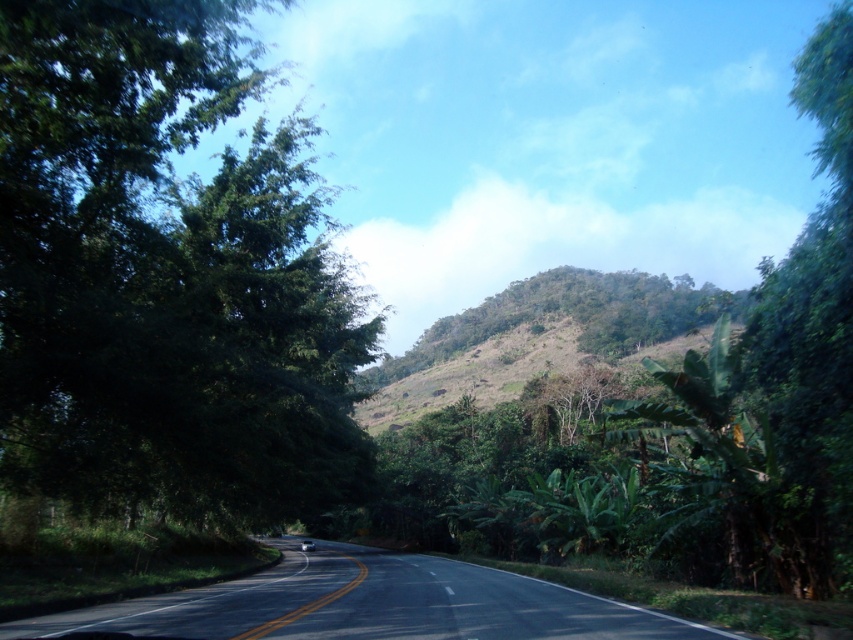
You are a hiker planning to take a photo of the green leafy tree at left and the black asphalt road at center from a viewpoint. Which object will appear larger in the photo?

The green leafy tree at left will appear larger in the photo because it is bigger than the black asphalt road at center.